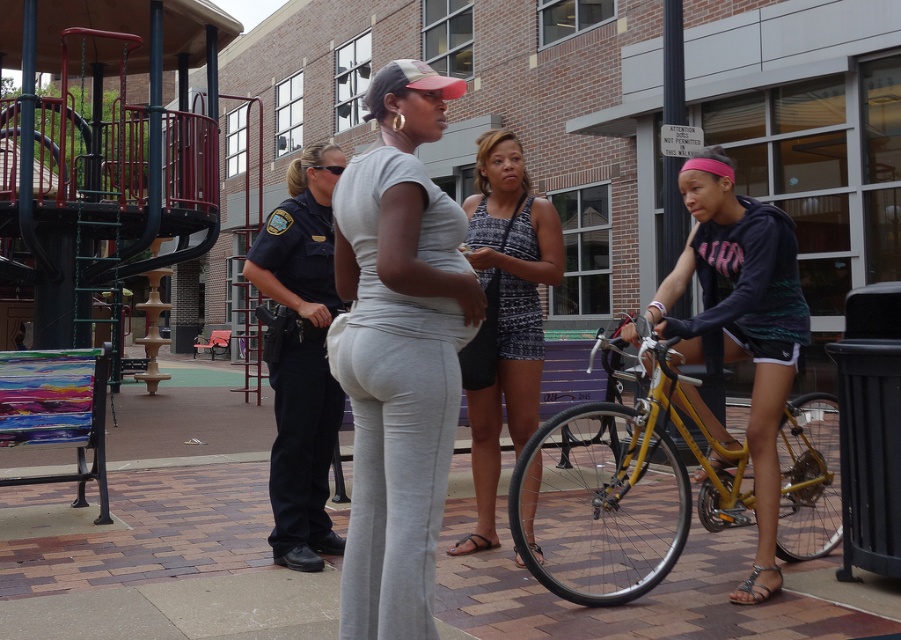
Where is `yellow metallic bicycle at right`? This screenshot has width=901, height=640. yellow metallic bicycle at right is located at coordinates (604, 496).

Can you confirm if dark blue jersey at center is shorter than printed fabric tank top at center?

Indeed, dark blue jersey at center has a lesser height compared to printed fabric tank top at center.

Which is more to the left, dark blue jersey at center or printed fabric tank top at center?

printed fabric tank top at center

At what (x,y) coordinates should I click in order to perform the action: click on dark blue jersey at center. Please return your answer as a coordinate pair (x, y). This screenshot has height=640, width=901. Looking at the image, I should click on (740, 323).

You are a GUI agent. You are given a task and a screenshot of the screen. Output one action in this format:
    pyautogui.click(x=<x>, y=<y>)
    Task: Click on the dark blue jersey at center
    Image resolution: width=901 pixels, height=640 pixels.
    Given the screenshot: What is the action you would take?
    pyautogui.click(x=740, y=323)

Based on the photo, can you confirm if yellow metallic bicycle at right is taller than printed fabric tank top at center?

Incorrect, yellow metallic bicycle at right's height is not larger of printed fabric tank top at center's.

Is yellow metallic bicycle at right positioned behind printed fabric tank top at center?

No, yellow metallic bicycle at right is in front of printed fabric tank top at center.

Is point (657, 342) positioned in front of point (544, 246)?

Yes, it is in front of point (544, 246).

In order to click on yellow metallic bicycle at right in this screenshot , I will do `click(604, 496)`.